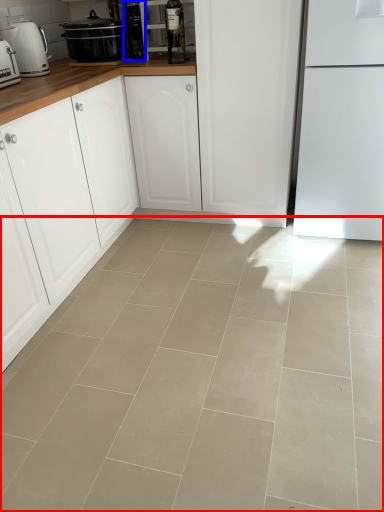
Question: Among these objects, which one is nearest to the camera, concrete (highlighted by a red box) or appliance (highlighted by a blue box)?

Choices:
 (A) concrete
 (B) appliance

Answer: (A)